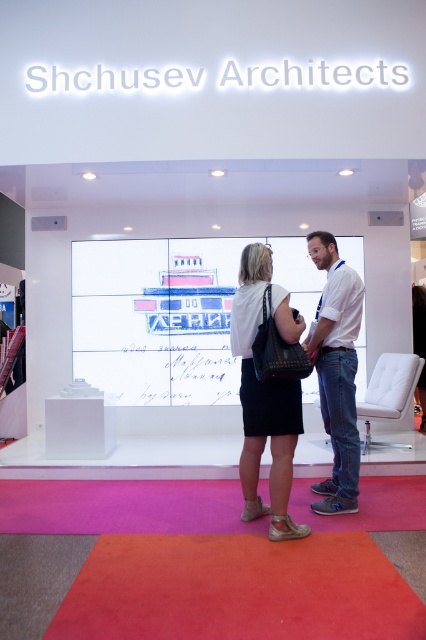
Who is higher up, white matte skirt at center or white cotton shirt at center?

Positioned higher is white cotton shirt at center.

Is white matte skirt at center to the left of white cotton shirt at center from the viewer's perspective?

Indeed, white matte skirt at center is positioned on the left side of white cotton shirt at center.

Is point (290, 484) less distant than point (342, 324)?

Yes, point (290, 484) is closer to viewer.

I want to click on white matte skirt at center, so click(264, 403).